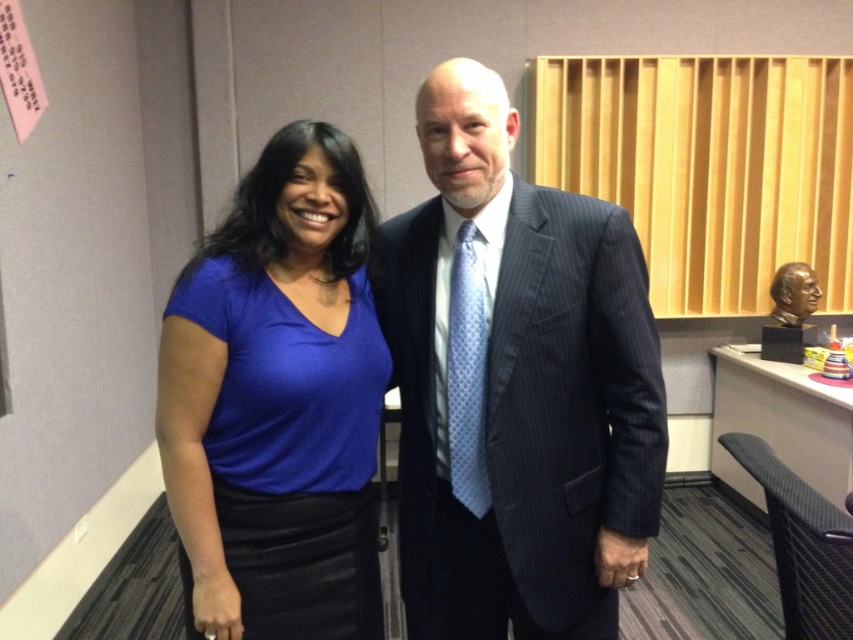
Question: Which point is farther to the camera?

Choices:
 (A) [212, 532]
 (B) [614, 620]

Answer: (B)

Question: Where is dark blue pinstripe suit at center located in relation to matte blue shirt at center in the image?

Choices:
 (A) above
 (B) below

Answer: (A)

Question: Can you confirm if dark blue pinstripe suit at center is positioned to the right of matte blue shirt at center?

Choices:
 (A) yes
 (B) no

Answer: (A)

Question: Which point is closer to the camera?

Choices:
 (A) matte blue shirt at center
 (B) dark blue pinstripe suit at center

Answer: (A)

Question: Can you confirm if dark blue pinstripe suit at center is positioned above matte blue shirt at center?

Choices:
 (A) no
 (B) yes

Answer: (B)

Question: Which object is closer to the camera taking this photo?

Choices:
 (A) dark blue pinstripe suit at center
 (B) matte blue shirt at center

Answer: (B)